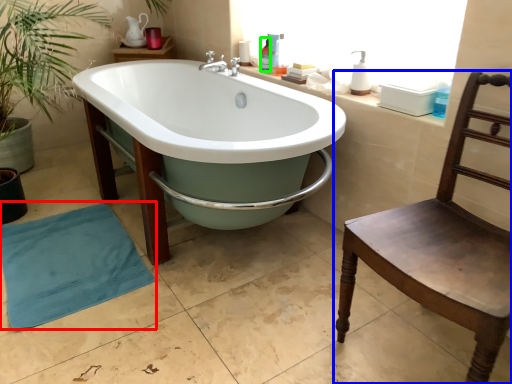
Question: Based on their relative distances, which object is nearer to beach towel (highlighted by a red box)? Choose from chair (highlighted by a blue box) and toiletry (highlighted by a green box).

Choices:
 (A) chair
 (B) toiletry

Answer: (A)